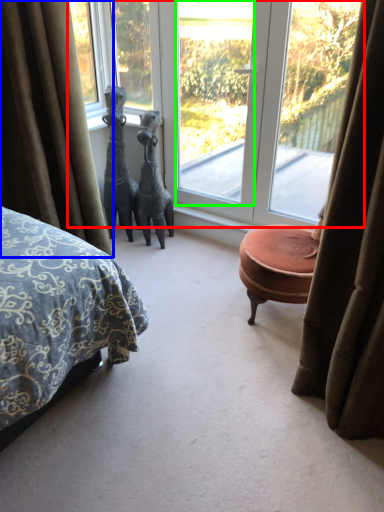
Question: Considering the real-world distances, which object is closest to window (highlighted by a red box)? curtain (highlighted by a blue box) or window screen (highlighted by a green box).

Choices:
 (A) curtain
 (B) window screen

Answer: (B)